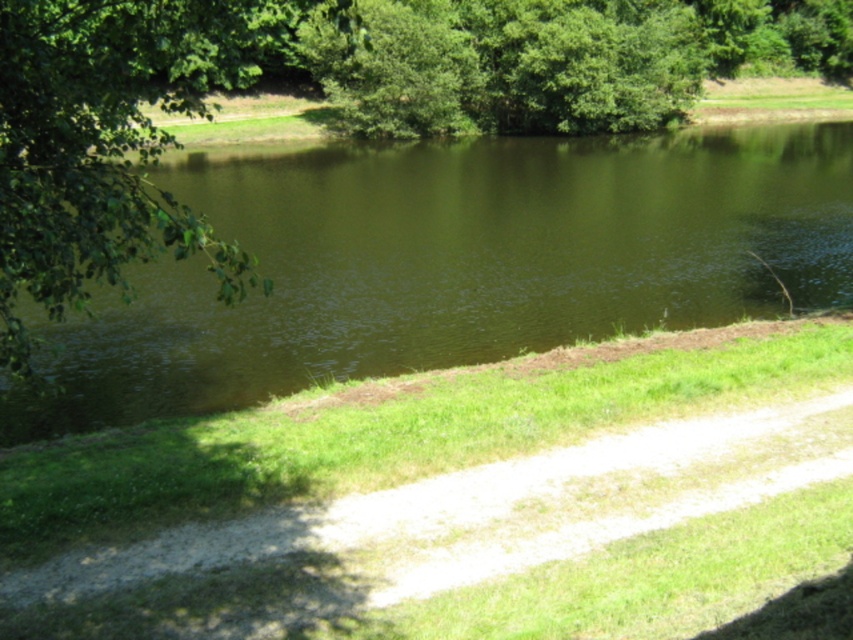
Is green water at center bigger than green leafy tree at left?

Yes, green water at center is bigger than green leafy tree at left.

Is green water at center wider than green leafy tree at left?

Yes, green water at center is wider than green leafy tree at left.

From the picture: Who is more distant from viewer, (351, 236) or (15, 218)?

Point (351, 236)

Locate an element on the screen. green water at center is located at coordinates (451, 262).